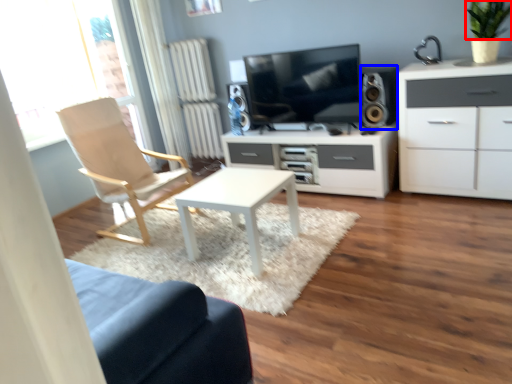
Question: Which object appears farthest to the camera in this image, plant (highlighted by a red box) or speaker (highlighted by a blue box)?

Choices:
 (A) plant
 (B) speaker

Answer: (B)